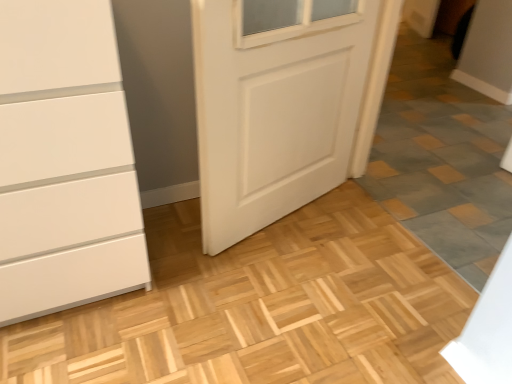
In order to face white matte door at center, should I rotate leftwards or rightwards?

Rotate your view right by about 5.476°.

Identify the location of white matte door at center. (160, 95).

The width and height of the screenshot is (512, 384). What do you see at coordinates (160, 95) in the screenshot? I see `white matte door at center` at bounding box center [160, 95].

What do you see at coordinates (442, 159) in the screenshot?
I see `gray stone tile at lower right` at bounding box center [442, 159].

Locate an element on the screen. gray stone tile at lower right is located at coordinates (442, 159).

This screenshot has height=384, width=512. In order to click on white matte door at center in this screenshot , I will do [x=160, y=95].

Which is more to the left, gray stone tile at lower right or white matte door at center?

white matte door at center is more to the left.

Considering their positions, is gray stone tile at lower right located in front of or behind white matte door at center?

Clearly, gray stone tile at lower right is in front of white matte door at center.

Does point (419, 56) appear closer or farther from the camera than point (170, 159)?

Point (419, 56).

From the image's perspective, is gray stone tile at lower right located above or below white matte door at center?

Based on their image positions, gray stone tile at lower right is located beneath white matte door at center.

From a real-world perspective, is gray stone tile at lower right physically below white matte door at center?

No, from a real-world perspective, gray stone tile at lower right is not beneath white matte door at center.

Can you confirm if gray stone tile at lower right is thinner than white matte door at center?

Correct, the width of gray stone tile at lower right is less than that of white matte door at center.

Which of these two, gray stone tile at lower right or white matte door at center, stands shorter?

white matte door at center.

Considering the relative sizes of gray stone tile at lower right and white matte door at center in the image provided, is gray stone tile at lower right bigger than white matte door at center?

No.

Can we say gray stone tile at lower right lies outside white matte door at center?

Indeed, gray stone tile at lower right is completely outside white matte door at center.

Are gray stone tile at lower right and white matte door at center located far from each other?

No, there isn't a large distance between gray stone tile at lower right and white matte door at center.

Is gray stone tile at lower right oriented towards white matte door at center?

Yes, gray stone tile at lower right is aimed at white matte door at center.

Consider the image. Measure the distance from gray stone tile at lower right to white matte door at center.

gray stone tile at lower right is 29.43 inches from white matte door at center.

In order to click on tile in front of the white matte door at center in this screenshot , I will do `click(442, 159)`.

Does white matte door at center appear on the right side of gray stone tile at lower right?

In fact, white matte door at center is to the left of gray stone tile at lower right.

Is white matte door at center positioned in front of gray stone tile at lower right?

No, white matte door at center is behind gray stone tile at lower right.

Considering the points (303, 63) and (443, 63), which point is in front, point (303, 63) or point (443, 63)?

The point (303, 63) is closer.

From the image's perspective, which one is positioned lower, white matte door at center or gray stone tile at lower right?

gray stone tile at lower right.

From a real-world perspective, is white matte door at center on gray stone tile at lower right?

Incorrect, from a real-world perspective, white matte door at center is lower than gray stone tile at lower right.

From the picture: Can you confirm if white matte door at center is thinner than gray stone tile at lower right?

In fact, white matte door at center might be wider than gray stone tile at lower right.

Considering the sizes of objects white matte door at center and gray stone tile at lower right in the image provided, who is shorter, white matte door at center or gray stone tile at lower right?

Standing shorter between the two is white matte door at center.

Considering the sizes of white matte door at center and gray stone tile at lower right in the image, is white matte door at center bigger or smaller than gray stone tile at lower right?

Result: white matte door at center is bigger than gray stone tile at lower right.

Is gray stone tile at lower right a part of white matte door at center?

No.

Are white matte door at center and gray stone tile at lower right making contact?

white matte door at center and gray stone tile at lower right are not in contact.

Could you tell me if white matte door at center is facing gray stone tile at lower right?

Yes, white matte door at center is oriented towards gray stone tile at lower right.

Can you tell me how much white matte door at center and gray stone tile at lower right differ in facing direction?

white matte door at center and gray stone tile at lower right are facing 109 degrees away from each other.

Measure the distance from white matte door at center to gray stone tile at lower right.

white matte door at center and gray stone tile at lower right are 29.43 inches apart from each other.

You are a GUI agent. You are given a task and a screenshot of the screen. Output one action in this format:
    pyautogui.click(x=<x>, y=<y>)
    Task: Click on the tile on the right of white matte door at center
    The width and height of the screenshot is (512, 384).
    Given the screenshot: What is the action you would take?
    pyautogui.click(x=442, y=159)

Identify the location of tile positioned vertically above the white matte door at center (from a real-world perspective). The height and width of the screenshot is (384, 512). (442, 159).

Locate an element on the screen. Image resolution: width=512 pixels, height=384 pixels. door on the left of gray stone tile at lower right is located at coordinates (160, 95).